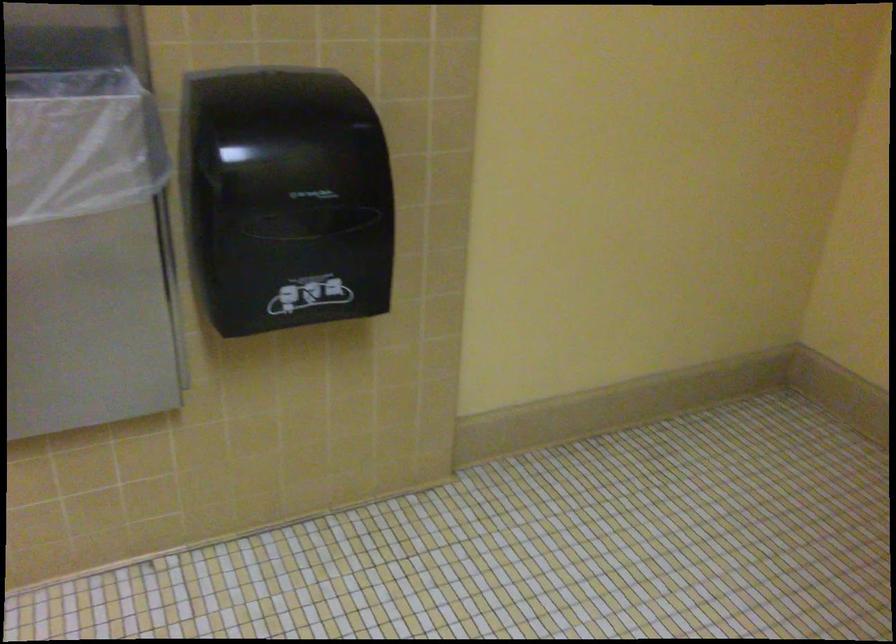
Question: How did the camera likely rotate?

Choices:
 (A) Left
 (B) Right
 (C) Up
 (D) Down

Answer: (A)